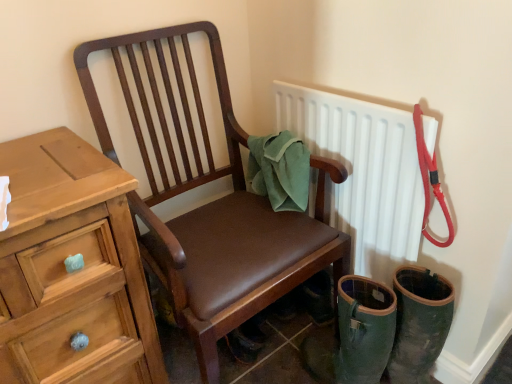
The height and width of the screenshot is (384, 512). What do you see at coordinates (74, 273) in the screenshot?
I see `wooden chest of drawers at left` at bounding box center [74, 273].

Describe the element at coordinates (211, 203) in the screenshot. I see `brown leather chair at center` at that location.

This screenshot has height=384, width=512. I want to click on wooden chest of drawers at left, so click(74, 273).

How different are the orientations of white matte radiator at upper right and wooden chest of drawers at left in degrees?

There is a 89.1-degree angle between the facing directions of white matte radiator at upper right and wooden chest of drawers at left.

Choose the correct answer: Is white matte radiator at upper right inside wooden chest of drawers at left or outside it?

white matte radiator at upper right cannot be found inside wooden chest of drawers at left.

You are a GUI agent. You are given a task and a screenshot of the screen. Output one action in this format:
    pyautogui.click(x=<x>, y=<y>)
    Task: Click on the chest of drawers in front of the white matte radiator at upper right
    The width and height of the screenshot is (512, 384).
    Given the screenshot: What is the action you would take?
    pyautogui.click(x=74, y=273)

Can you confirm if white matte radiator at upper right is shorter than wooden chest of drawers at left?

Indeed, white matte radiator at upper right has a lesser height compared to wooden chest of drawers at left.

In the scene shown: Which point is more forward, (284, 176) or (30, 289)?

The point (30, 289) is closer.

Can you confirm if green fabric towel at chair back is wider than wooden chest of drawers at left?

No, green fabric towel at chair back is not wider than wooden chest of drawers at left.

Is wooden chest of drawers at left surrounded by green fabric towel at chair back?

No, wooden chest of drawers at left is not a part of green fabric towel at chair back.

How much distance is there between brown leather chair at center and wooden chest of drawers at left?

10.85 inches.

Is brown leather chair at center oriented away from wooden chest of drawers at left?

brown leather chair at center does not have its back to wooden chest of drawers at left.

At what (x,y) coordinates should I click in order to perform the action: click on chair above the wooden chest of drawers at left (from a real-world perspective). Please return your answer as a coordinate pair (x, y). The width and height of the screenshot is (512, 384). Looking at the image, I should click on (211, 203).

From a real-world perspective, who is located lower, brown leather chair at center or wooden chest of drawers at left?

From a 3D spatial view, wooden chest of drawers at left is below.

Who is shorter, green fabric towel at chair back or brown leather chair at center?

Standing shorter between the two is green fabric towel at chair back.

Visually, is green fabric towel at chair back positioned to the left or to the right of brown leather chair at center?

Based on their positions, green fabric towel at chair back is located to the right of brown leather chair at center.

Is green fabric towel at chair back positioned with its back to brown leather chair at center?

Yes, green fabric towel at chair back is positioned with its back facing brown leather chair at center.

Which object is thinner, white matte radiator at upper right or green fabric towel at chair back?

With smaller width is white matte radiator at upper right.

Is white matte radiator at upper right looking in the opposite direction of green fabric towel at chair back?

Yes, white matte radiator at upper right is positioned with its back facing green fabric towel at chair back.

Is the depth of white matte radiator at upper right greater than that of green fabric towel at chair back?

No, the depth of white matte radiator at upper right is less than that of green fabric towel at chair back.

From a real-world perspective, is white matte radiator at upper right physically located above or below green fabric towel at chair back?

white matte radiator at upper right is below green fabric towel at chair back.

Is green fabric towel at chair back spatially inside white matte radiator at upper right, or outside of it?

green fabric towel at chair back is located beyond the bounds of white matte radiator at upper right.

Between green fabric towel at chair back and white matte radiator at upper right, which one is positioned in front?

Positioned in front is white matte radiator at upper right.

Who is bigger, green fabric towel at chair back or white matte radiator at upper right?

With larger size is white matte radiator at upper right.

Considering the relative positions of green fabric towel at chair back and white matte radiator at upper right in the image provided, is green fabric towel at chair back to the left or to the right of white matte radiator at upper right?

From the image, it's evident that green fabric towel at chair back is to the left of white matte radiator at upper right.

Is wooden chest of drawers at left located outside brown leather chair at center?

Absolutely, wooden chest of drawers at left is external to brown leather chair at center.

From the image's perspective, is wooden chest of drawers at left below brown leather chair at center?

Yes, from the image's perspective, wooden chest of drawers at left is below brown leather chair at center.

In the scene shown: Between wooden chest of drawers at left and brown leather chair at center, which one is positioned in front?

wooden chest of drawers at left is closer to the camera.

Can you confirm if wooden chest of drawers at left is wider than brown leather chair at center?

No, wooden chest of drawers at left is not wider than brown leather chair at center.

Locate an element on the screen. The image size is (512, 384). chest of drawers to the left of white matte radiator at upper right is located at coordinates (74, 273).

This screenshot has width=512, height=384. I want to click on material above the wooden chest of drawers at left (from a real-world perspective), so (279, 170).

Looking at this image, which object lies nearer to the anchor point green fabric towel at chair back, white matte radiator at upper right or brown leather chair at center?

white matte radiator at upper right.

Based on their spatial positions, is green fabric towel at chair back or white matte radiator at upper right closer to wooden chest of drawers at left?

green fabric towel at chair back.

Based on their spatial positions, is wooden chest of drawers at left or white matte radiator at upper right closer to brown leather chair at center?

white matte radiator at upper right.

Which object lies nearer to the anchor point brown leather chair at center, green fabric towel at chair back or white matte radiator at upper right?

Based on the image, green fabric towel at chair back appears to be nearer to brown leather chair at center.

Which object lies nearer to the anchor point wooden chest of drawers at left, brown leather chair at center or white matte radiator at upper right?

Based on the image, brown leather chair at center appears to be nearer to wooden chest of drawers at left.

Which object lies nearer to the anchor point brown leather chair at center, white matte radiator at upper right or green fabric towel at chair back?

green fabric towel at chair back is closer to brown leather chair at center.

Looking at the image, which one is located further to white matte radiator at upper right, wooden chest of drawers at left or green fabric towel at chair back?

wooden chest of drawers at left lies further to white matte radiator at upper right than the other object.

From the picture: From the image, which object appears to be farther from wooden chest of drawers at left, white matte radiator at upper right or brown leather chair at center?

white matte radiator at upper right is positioned further to the anchor wooden chest of drawers at left.

Identify the location of chair situated between wooden chest of drawers at left and green fabric towel at chair back from left to right. (211, 203).

At what (x,y) coordinates should I click in order to perform the action: click on radiator located between brown leather chair at center and green fabric towel at chair back in the depth direction. Please return your answer as a coordinate pair (x, y). The height and width of the screenshot is (384, 512). Looking at the image, I should click on (362, 173).

I want to click on material between wooden chest of drawers at left and white matte radiator at upper right in the horizontal direction, so click(x=279, y=170).

What are the coordinates of `chair situated between wooden chest of drawers at left and white matte radiator at upper right from left to right` in the screenshot? It's located at (211, 203).